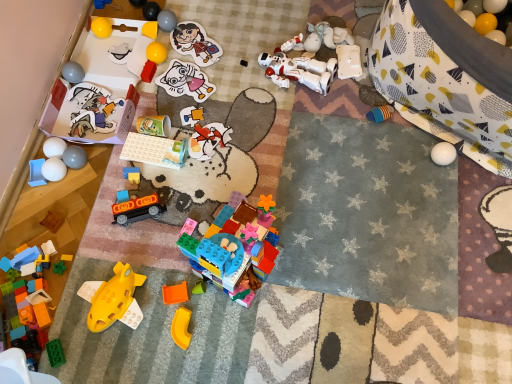
Where is `free area in between white plastic remote control at upper center, which is the second toy from right to left, and orange matte train at center, which is the twelfth toy in right-to-left order`? The image size is (512, 384). free area in between white plastic remote control at upper center, which is the second toy from right to left, and orange matte train at center, which is the twelfth toy in right-to-left order is located at coordinates (250, 139).